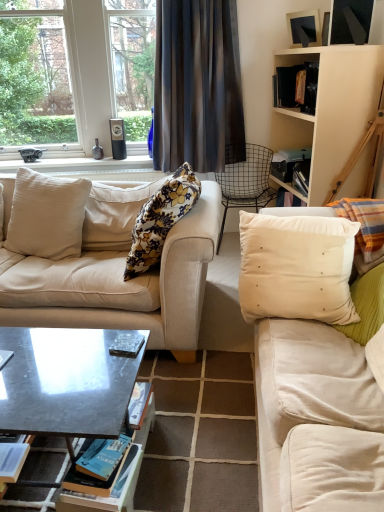
Locate an element on the screen. free point above dark gray polished wood coffee table at center (from a real-world perspective) is located at coordinates (56, 362).